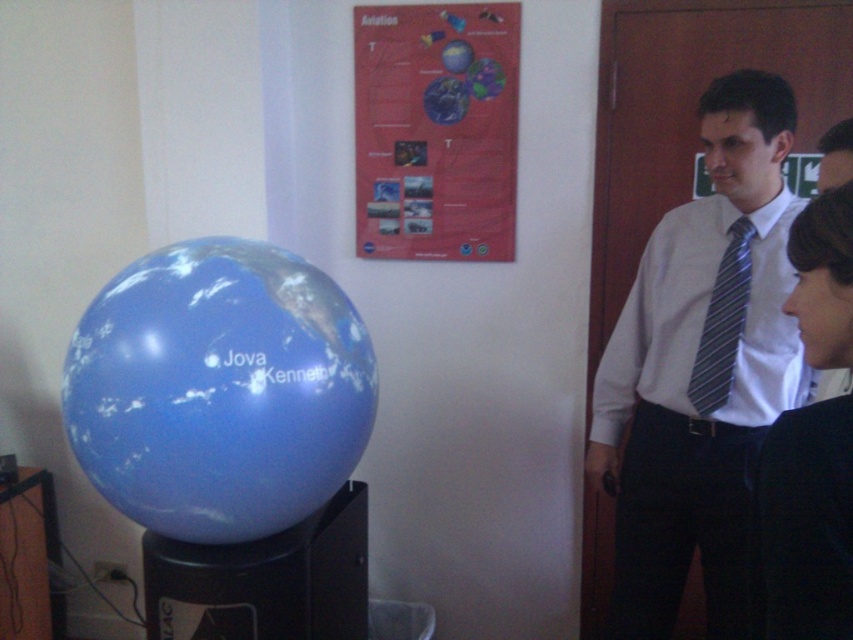
Is white shirt with tie at right to the right of red paper poster at upper center from the viewer's perspective?

Indeed, white shirt with tie at right is positioned on the right side of red paper poster at upper center.

Locate an element on the screen. white shirt with tie at right is located at coordinates tap(701, 369).

Can you confirm if red paper poster at upper center is positioned below black fabric business suit at lower right?

No, red paper poster at upper center is not below black fabric business suit at lower right.

Which is more to the right, red paper poster at upper center or black fabric business suit at lower right?

Positioned to the right is black fabric business suit at lower right.

Is point (500, 77) closer to viewer compared to point (813, 458)?

No, (500, 77) is further to viewer.

The width and height of the screenshot is (853, 640). I want to click on red paper poster at upper center, so click(434, 131).

Who is more forward, (782,417) or (700,403)?

Point (782,417) is more forward.

What do you see at coordinates (804, 525) in the screenshot?
I see `black fabric business suit at lower right` at bounding box center [804, 525].

Find the location of `black fabric business suit at lower right`. black fabric business suit at lower right is located at coordinates (804, 525).

Locate an element on the screen. black fabric business suit at lower right is located at coordinates (804, 525).